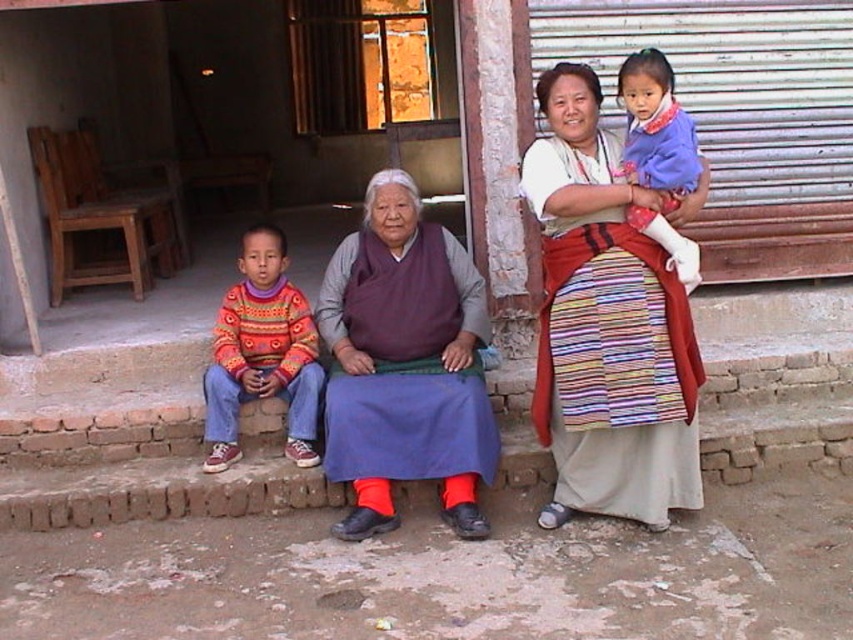
You are a tailor who needs to decide which item to take first for mending. Based on the size difference between the multicolored woven cloth at center and the purple woolen vest at center, which one should you choose if you prioritize working on the smaller item first?

The multicolored woven cloth at center has a smaller size compared to the purple woolen vest at center, so you should choose the multicolored woven cloth at center first.

You are standing in front of the scene and want to determine which of the two points, point (579, 134) or point (393, 356), is nearer to you. Based on the description, which point is closer?

Point (579, 134) is closer to the camera than point (393, 356), so it is the nearer one.

You are a photographer standing 1.5 meters away from the camera. You want to take a photo of the purple woolen vest at center. Can you reach the camera to take the photo without moving from your current position?

The purple woolen vest at center and camera are 3.65 meters apart. Since you are 1.5 meters away from the camera, the total distance between you and the vest would be 5.15 meters. Whether you can reach it depends on your camera lens. If you have a telephoto lens, you can capture the vest from that distance. Without a telephoto lens, it might be challenging to get a clear closeup.